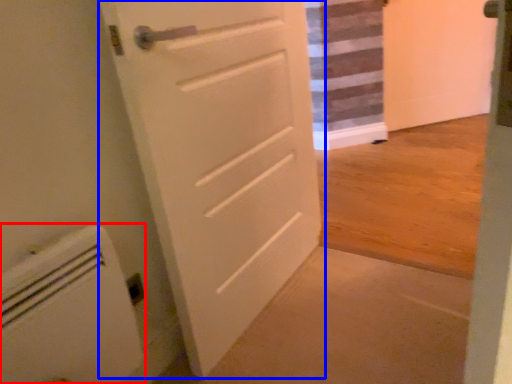
Question: Among these objects, which one is nearest to the camera, appliance (highlighted by a red box) or door (highlighted by a blue box)?

Choices:
 (A) appliance
 (B) door

Answer: (A)